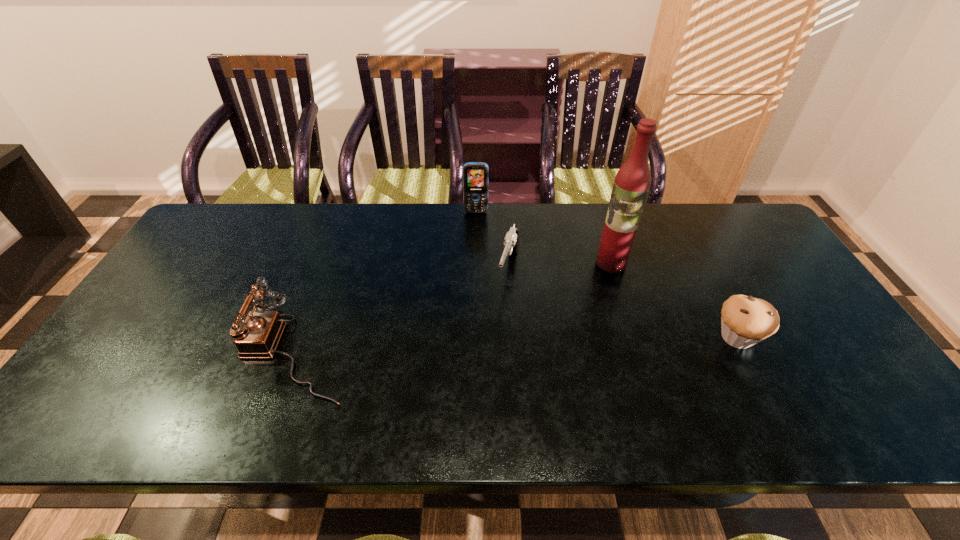
I want to click on object identified as the second closest to the rightmost object, so click(x=511, y=241).

Find the location of a particular element. vacant area in the image that satisfies the following two spatial constraints: 1. on the front side of the farthest object; 2. on the left side of the third object from left to right is located at coordinates (475, 269).

Image resolution: width=960 pixels, height=540 pixels. I want to click on vacant area that satisfies the following two spatial constraints: 1. on the back side of the tallest object; 2. on the right side of the gun, so click(509, 262).

I want to click on free space that satisfies the following two spatial constraints: 1. on the front side of the cellular telephone; 2. on the left side of the muffin, so click(474, 338).